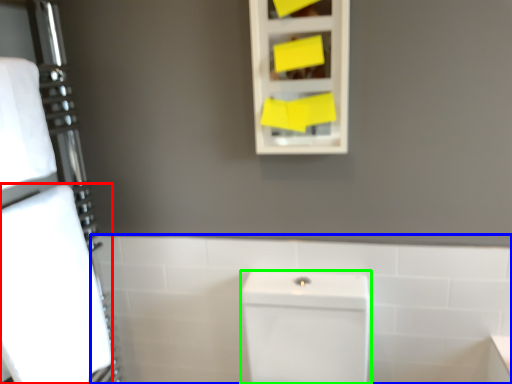
Question: Which object is positioned closest to bath towel (highlighted by a red box)? Select from bath (highlighted by a blue box) and porcelain (highlighted by a green box).

Choices:
 (A) bath
 (B) porcelain

Answer: (A)